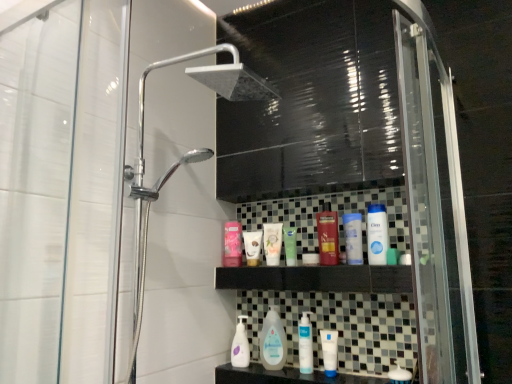
Question: Is white glossy soap at lower center, which ranks as the 8th toiletry in left-to-right order, positioned far away from matte white tube at center, arranged as the 7th toiletry when viewed from the right?

Choices:
 (A) yes
 (B) no

Answer: (B)

Question: From a real-world perspective, is white glossy soap at lower center, the first toiletry when ordered from right to left, positioned under matte white tube at center, arranged as the 7th toiletry when viewed from the right, based on gravity?

Choices:
 (A) no
 (B) yes

Answer: (B)

Question: Is matte white tube at center, which is the 2th toiletry in left-to-right order, located within white glossy soap at lower center, the first toiletry when ordered from right to left?

Choices:
 (A) no
 (B) yes

Answer: (A)

Question: Can you confirm if white glossy soap at lower center, the first toiletry when ordered from right to left, is shorter than matte white tube at center, arranged as the 7th toiletry when viewed from the right?

Choices:
 (A) no
 (B) yes

Answer: (B)

Question: Can you confirm if white glossy soap at lower center, the first toiletry when ordered from right to left, is bigger than matte white tube at center, which is the 2th toiletry in left-to-right order?

Choices:
 (A) yes
 (B) no

Answer: (B)

Question: From the image's perspective, relative to clear plastic baby bottle at center, the second cleaning product in the left-to-right sequence, is white glossy soap at lower center, the first toiletry when ordered from right to left, above or below?

Choices:
 (A) above
 (B) below

Answer: (B)

Question: Choose the correct answer: Is white glossy soap at lower center, which ranks as the 8th toiletry in left-to-right order, inside clear plastic baby bottle at center, the second cleaning product in the left-to-right sequence, or outside it?

Choices:
 (A) outside
 (B) inside

Answer: (A)

Question: Based on their positions, is white glossy soap at lower center, the first toiletry when ordered from right to left, located to the left or right of clear plastic baby bottle at center, which is the first cleaning product in right-to-left order?

Choices:
 (A) left
 (B) right

Answer: (B)

Question: Looking at their shapes, would you say white glossy soap at lower center, the first toiletry when ordered from right to left, is wider or thinner than clear plastic baby bottle at center, which is the first cleaning product in right-to-left order?

Choices:
 (A) thin
 (B) wide

Answer: (A)

Question: Is green matte tube at center, arranged as the 5th toiletry when viewed from the right, inside the boundaries of white matte tube at center, the sixth toiletry viewed from the right, or outside?

Choices:
 (A) inside
 (B) outside

Answer: (B)

Question: Looking at their shapes, would you say green matte tube at center, arranged as the 5th toiletry when viewed from the right, is wider or thinner than white matte tube at center, marked as the third toiletry in a left-to-right arrangement?

Choices:
 (A) thin
 (B) wide

Answer: (A)

Question: Considering the positions of green matte tube at center, arranged as the 5th toiletry when viewed from the right, and white matte tube at center, marked as the third toiletry in a left-to-right arrangement, in the image, is green matte tube at center, arranged as the 5th toiletry when viewed from the right, taller or shorter than white matte tube at center, marked as the third toiletry in a left-to-right arrangement,?

Choices:
 (A) tall
 (B) short

Answer: (B)

Question: In the image, is green matte tube at center, the 4th toiletry in the left-to-right sequence, positioned in front of or behind white matte tube at center, marked as the third toiletry in a left-to-right arrangement?

Choices:
 (A) front
 (B) behind

Answer: (A)

Question: Based on their sizes in the image, would you say white matte tube at center, the 2th mouthwash from the right, is bigger or smaller than pink matte lotion at upper center, which appears as the 8th toiletry when viewed from the right?

Choices:
 (A) small
 (B) big

Answer: (A)

Question: Is white matte tube at center, placed as the 3th mouthwash when sorted from top to bottom, situated inside pink matte lotion at upper center, which appears as the 8th toiletry when viewed from the right, or outside?

Choices:
 (A) inside
 (B) outside

Answer: (B)